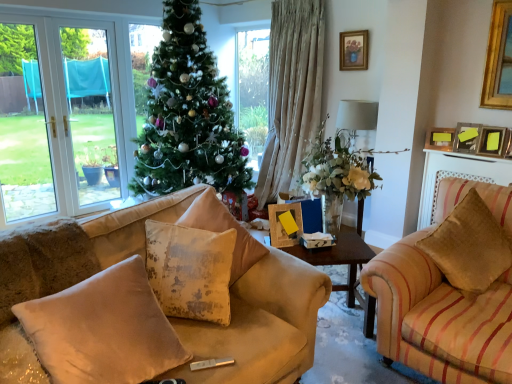
Question: Is translucent glass vase at center spatially inside transparent glass lamp at center, or outside of it?

Choices:
 (A) outside
 (B) inside

Answer: (A)

Question: In the image, is translucent glass vase at center on the left side or the right side of transparent glass lamp at center?

Choices:
 (A) left
 (B) right

Answer: (A)

Question: Estimate the real-world distances between objects in this image. Which object is closer to the wooden picture frame at upper right, which is the 2th picture frame from left to right?

Choices:
 (A) velvet beige pillow at right, the 1th pillow in the right-to-left sequence
 (B) transparent glass lamp at center
 (C) washed velvet cushion at center, the 3th pillow in the right-to-left sequence
 (D) gold-framed picture at upper center, which ranks as the first picture frame in left-to-right order
 (E) beige velvet pillow at lower left, arranged as the fourth pillow when viewed from the right

Answer: (B)

Question: Which is nearer to the distressed beige pillow at center, the 2th pillow from the right?

Choices:
 (A) green matte christmas tree at center
 (B) wooden picture frame at upper right, marked as the first picture frame in a right-to-left arrangement
 (C) velvet beige pillow at right, placed as the fourth pillow when sorted from left to right
 (D) beige velvet pillow at lower left, arranged as the fourth pillow when viewed from the right
 (E) wooden picture frame at upper right, which appears as the 2th picture frame when ordered from the bottom

Answer: (D)